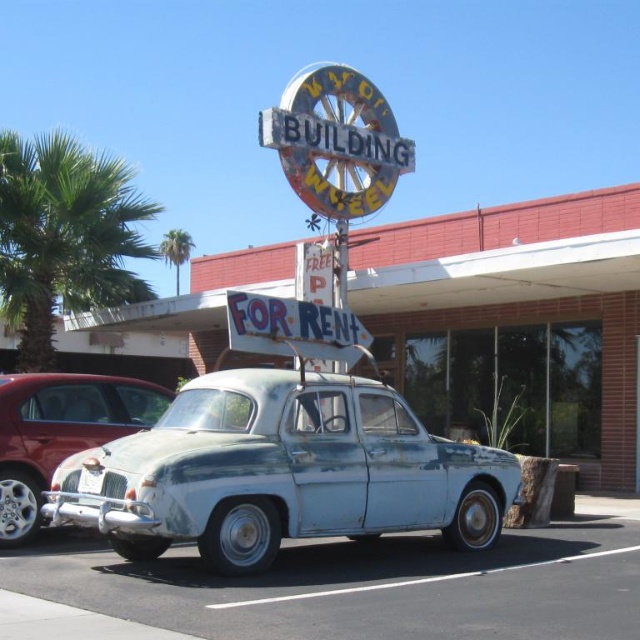
Which of these two, green leafy palm tree at left or green leafy palm tree at upper left, stands shorter?

green leafy palm tree at upper left

Between point (52, 240) and point (163, 248), which one is positioned behind?

The point (163, 248) is behind.

Find the location of `green leafy palm tree at left`. green leafy palm tree at left is located at coordinates (65, 236).

Does rusty metallic car at center appear over green leafy palm tree at upper left?

No.

Can you confirm if rusty metallic car at center is smaller than green leafy palm tree at upper left?

Yes.

Which is behind, point (202, 460) or point (172, 236)?

Point (172, 236)

Locate an element on the screen. This screenshot has width=640, height=640. rusty metallic car at center is located at coordinates (282, 472).

Does rusty metallic car at center appear over metallic/weathered sign at upper center?

Incorrect, rusty metallic car at center is not positioned above metallic/weathered sign at upper center.

Between rusty metallic car at center and metallic/weathered sign at upper center, which one is positioned higher?

metallic/weathered sign at upper center

Image resolution: width=640 pixels, height=640 pixels. What do you see at coordinates (282, 472) in the screenshot?
I see `rusty metallic car at center` at bounding box center [282, 472].

The image size is (640, 640). In order to click on rusty metallic car at center in this screenshot , I will do `click(282, 472)`.